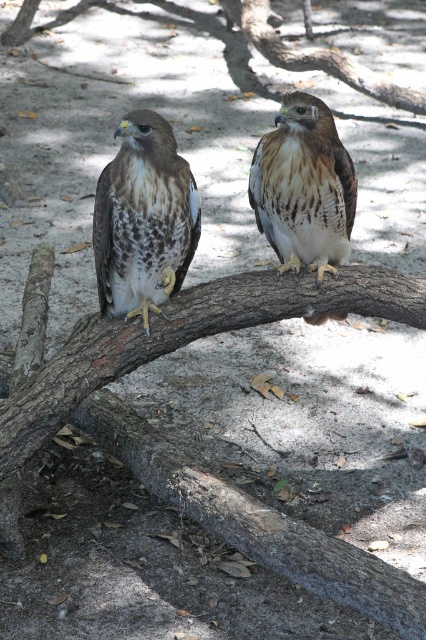
Between brown speckled feathers at left and brown speckled feathers at center, which one appears on the left side from the viewer's perspective?

brown speckled feathers at left

Is point (111, 228) positioned before point (313, 224)?

Yes.

What do you see at coordinates (143, 218) in the screenshot?
I see `brown speckled feathers at left` at bounding box center [143, 218].

Where is `brown speckled feathers at left`? brown speckled feathers at left is located at coordinates (143, 218).